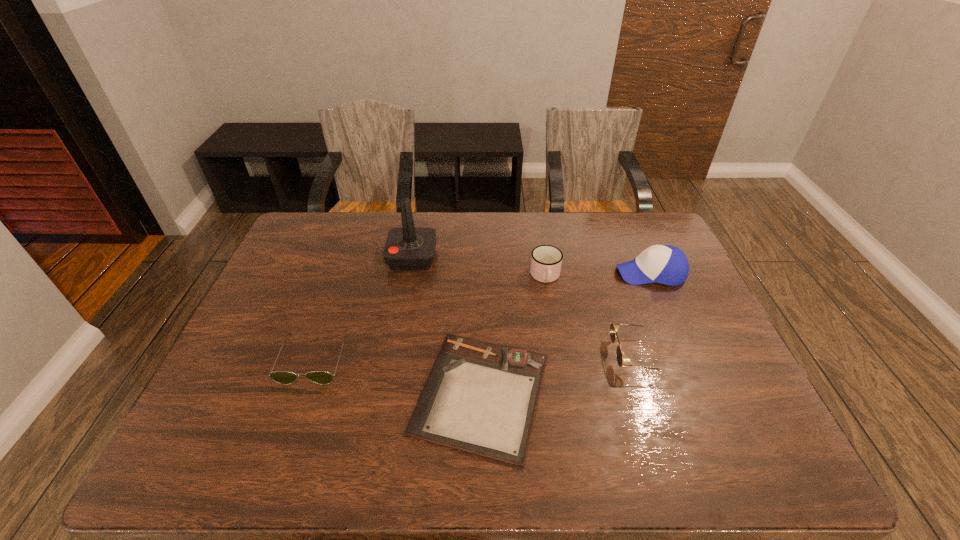
You are a GUI agent. You are given a task and a screenshot of the screen. Output one action in this format:
    pyautogui.click(x=<x>, y=<y>)
    Task: Click on the blank area located on the front-facing side of the baseball cap
    The height and width of the screenshot is (540, 960).
    Given the screenshot: What is the action you would take?
    pyautogui.click(x=578, y=273)

This screenshot has width=960, height=540. What are the coordinates of `free space located 0.260m on the side of the mug with the handle` in the screenshot? It's located at (559, 360).

Image resolution: width=960 pixels, height=540 pixels. I want to click on vacant area situated 0.140m on the front lenses of the taller sunglasses, so click(558, 355).

You are a GUI agent. You are given a task and a screenshot of the screen. Output one action in this format:
    pyautogui.click(x=<x>, y=<y>)
    Task: Click on the blank space located on the front lenses of the taller sunglasses
    This screenshot has height=540, width=960.
    Given the screenshot: What is the action you would take?
    pyautogui.click(x=562, y=355)

Where is `vacant space positioned on the front lenses of the taller sunglasses`? The width and height of the screenshot is (960, 540). vacant space positioned on the front lenses of the taller sunglasses is located at coordinates 523,355.

The height and width of the screenshot is (540, 960). Find the location of `free spot located 0.140m on the front-facing side of the left sunglasses`. free spot located 0.140m on the front-facing side of the left sunglasses is located at coordinates (286, 438).

Locate an element on the screen. Image resolution: width=960 pixels, height=540 pixels. vacant space located 0.120m on the right of the shortest object is located at coordinates (603, 393).

Find the location of a particular element. This screenshot has width=960, height=540. object that is at the far edge is located at coordinates (408, 248).

Find the location of a particular element. object that is at the near edge is located at coordinates (480, 397).

The height and width of the screenshot is (540, 960). Find the location of `object that is positioned at the left edge`. object that is positioned at the left edge is located at coordinates (282, 377).